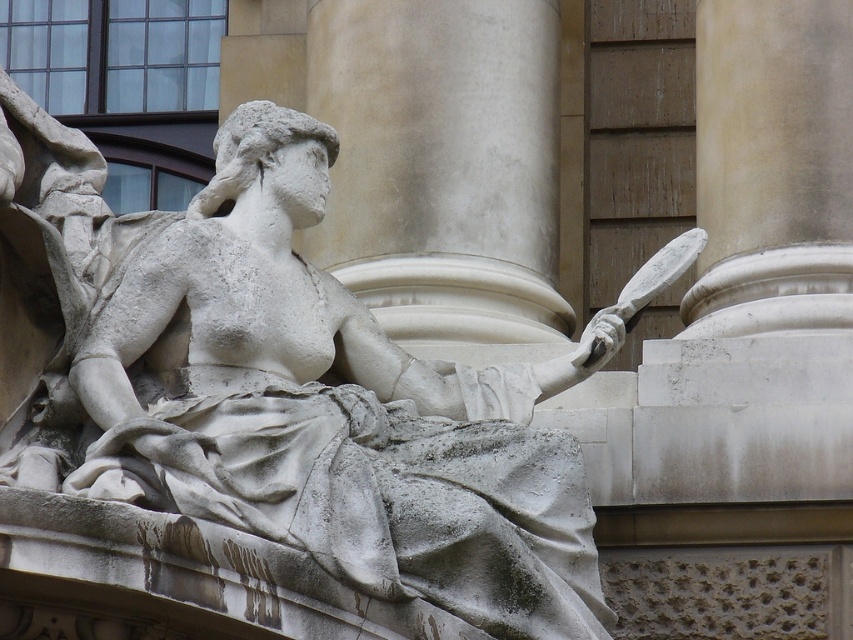
In the scene shown: Who is lower down, white stone statue at center or white marble column at center?

white stone statue at center is below.

Which is behind, point (234, 460) or point (834, 316)?

Positioned behind is point (834, 316).

Does point (437, 563) come behind point (698, 168)?

No, it is not.

Identify the location of white stone statue at center. (323, 406).